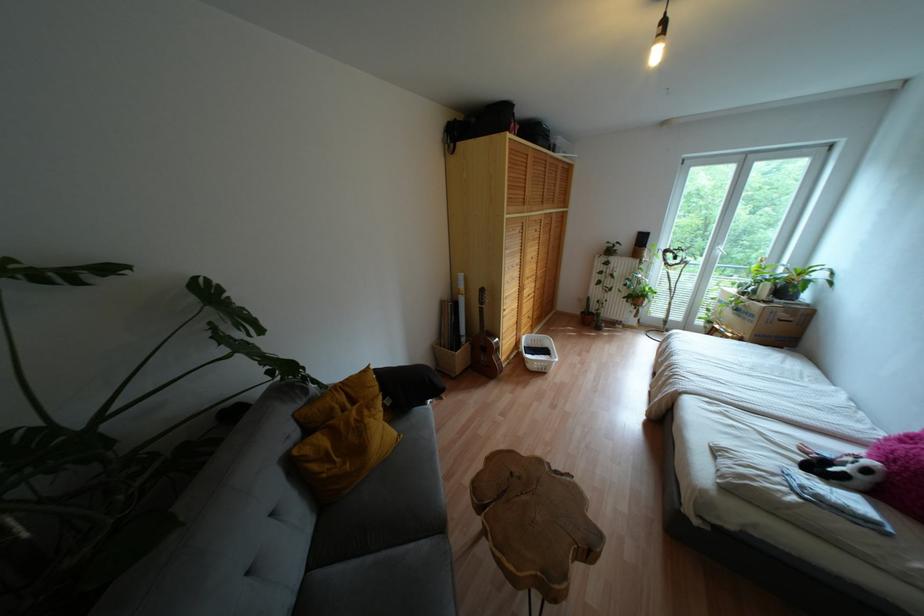
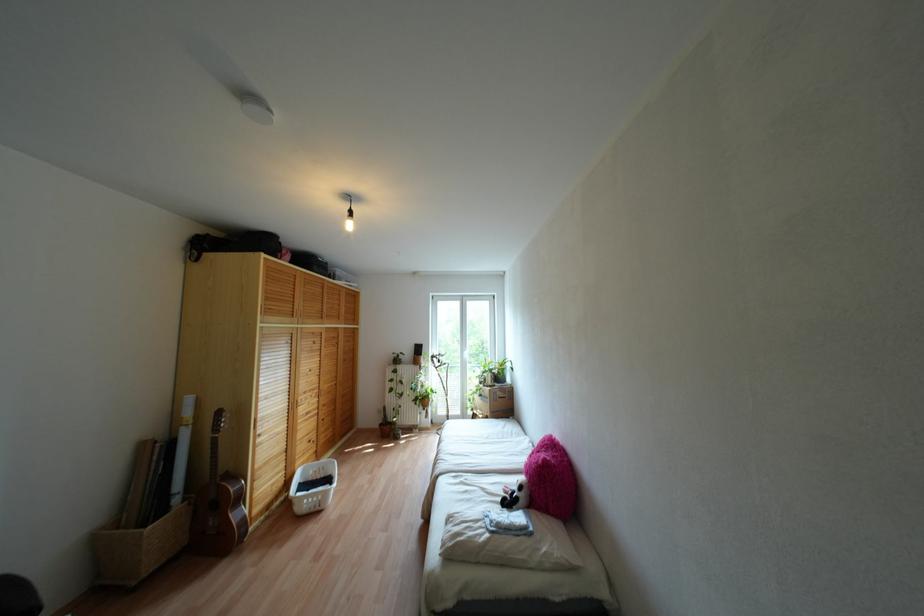
The point at (453, 151) is marked in the first image. Where is the corresponding point in the second image?

(196, 260)